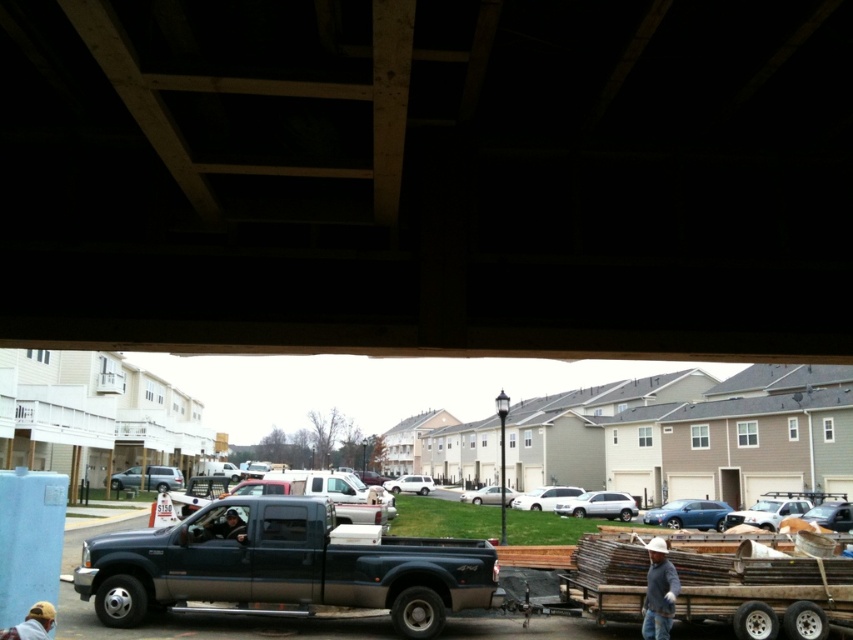
Question: Is wooden beams at upper center in front of white hard hat at lower right?

Choices:
 (A) yes
 (B) no

Answer: (A)

Question: Which point is farther to the camera?

Choices:
 (A) (660, 582)
 (B) (289, 557)

Answer: (B)

Question: Is wooden beams at upper center to the right of matte dark green truck at center from the viewer's perspective?

Choices:
 (A) yes
 (B) no

Answer: (A)

Question: Is wooden beams at upper center smaller than white hard hat at lower right?

Choices:
 (A) yes
 (B) no

Answer: (B)

Question: Which is farther from the white hard hat at lower right?

Choices:
 (A) wooden beams at upper center
 (B) matte dark green truck at center

Answer: (B)

Question: Which of the following is the closest to the observer?

Choices:
 (A) white hard hat at lower right
 (B) matte dark green truck at center
 (C) wooden beams at upper center

Answer: (C)